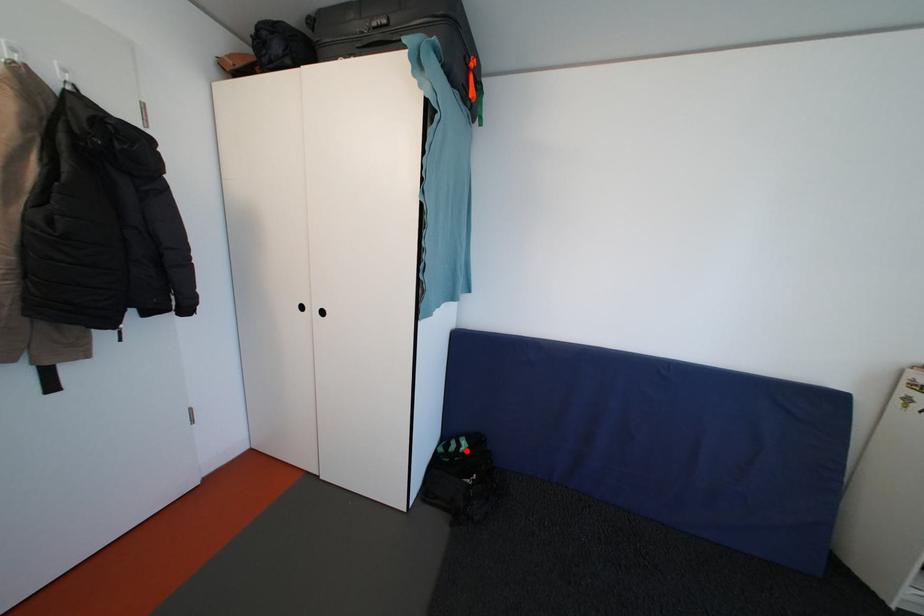
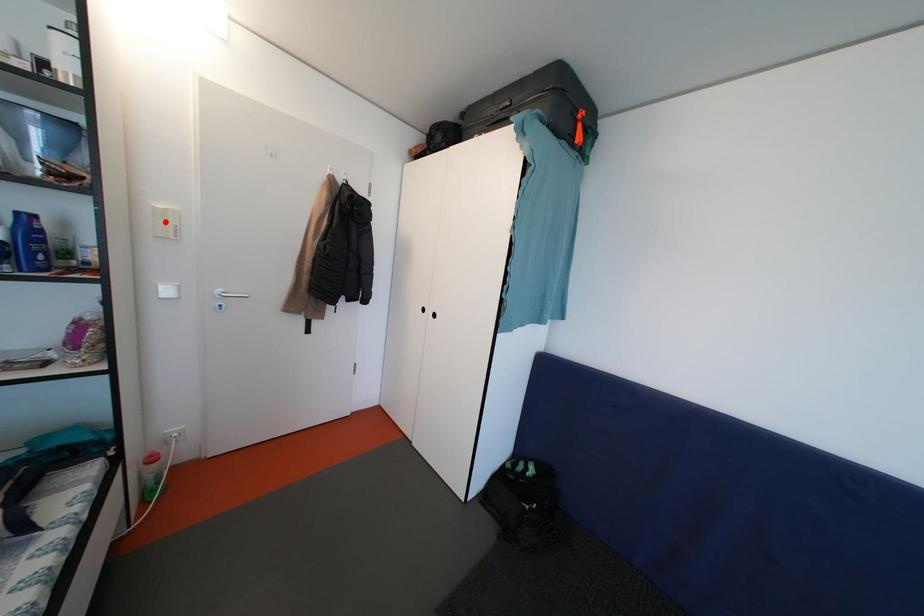
I am providing you with two images of the same scene from different viewpoints. A red point is marked on the first image and another point is marked on the second image. Are the points marked in image1 and image2 representing the same 3D position?

No